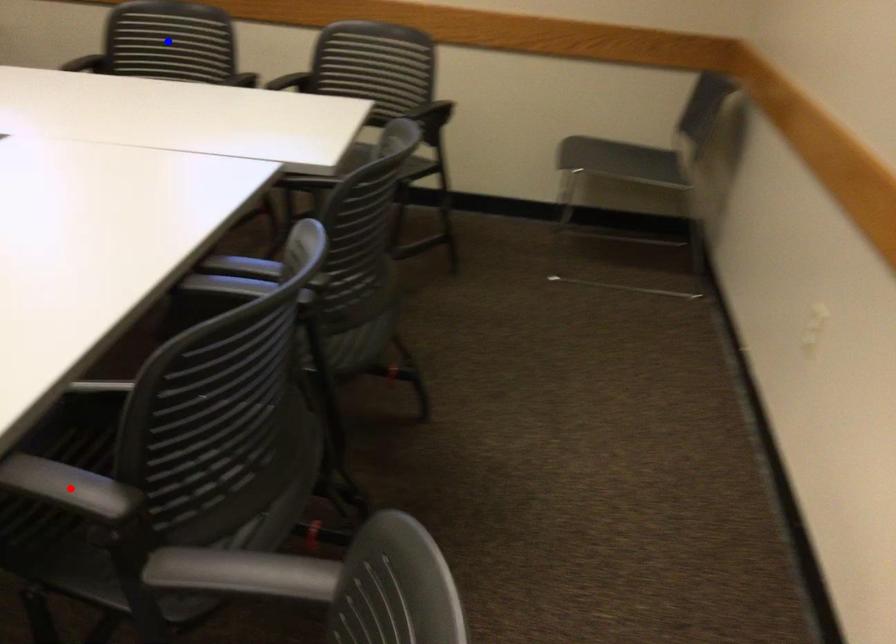
Question: In the image, two points are highlighted. Which point is nearer to the camera? Reply with the corresponding letter.

Choices:
 (A) blue point
 (B) red point

Answer: (B)